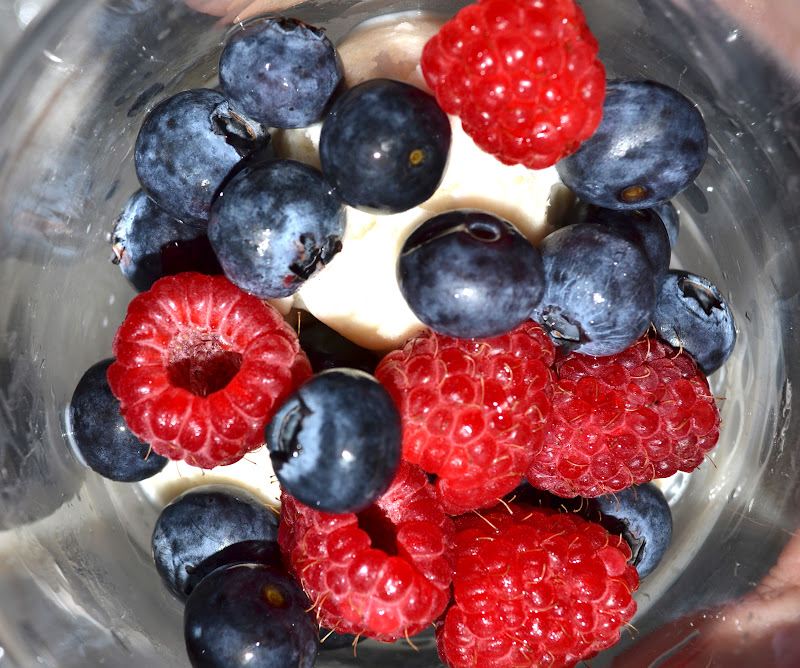
Find the location of `gray stripe on glass jar`. gray stripe on glass jar is located at coordinates (722, 104), (758, 534), (326, 13).